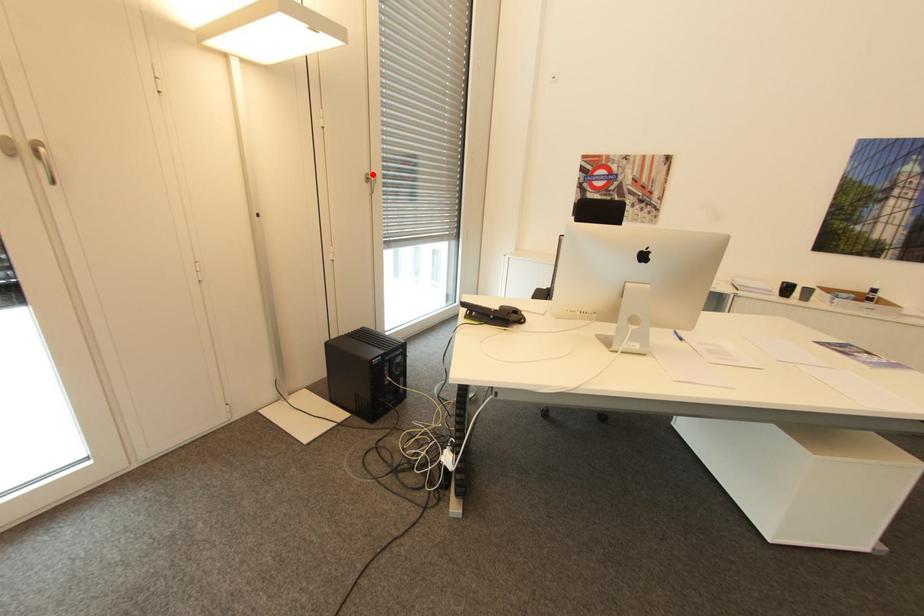
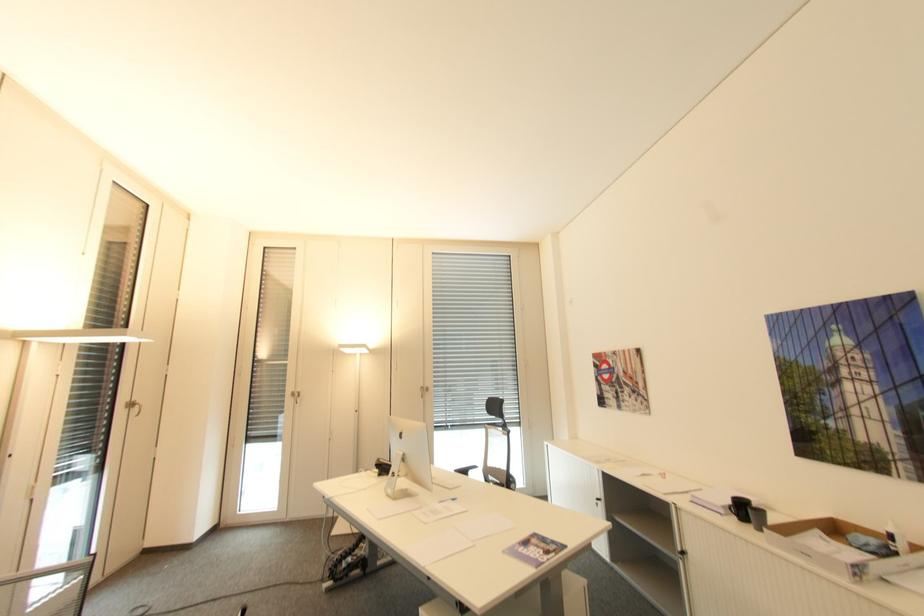
Question: I am providing you with two images of the same scene from different viewpoints. Image1 has a red point marked. In image2, the corresponding 3D location appears at what relative position? Reply with the corresponding letter.

Choices:
 (A) Closer
 (B) Farther

Answer: (B)